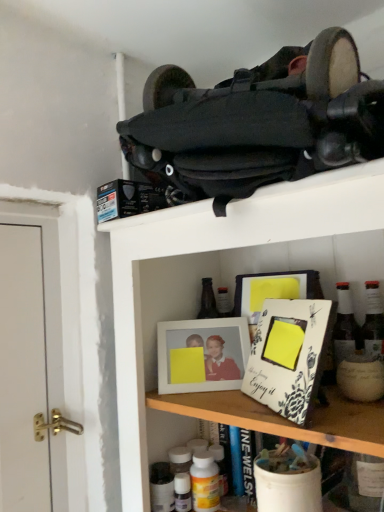
Question: Is yellow matte bottle at lower center smaller than white matte picture frame at center?

Choices:
 (A) yes
 (B) no

Answer: (A)

Question: Is yellow matte bottle at lower center turned away from white matte picture frame at center?

Choices:
 (A) no
 (B) yes

Answer: (A)

Question: Would you say white matte picture frame at center is part of yellow matte bottle at lower center's contents?

Choices:
 (A) yes
 (B) no

Answer: (B)

Question: From a real-world perspective, is yellow matte bottle at lower center under white matte picture frame at center?

Choices:
 (A) yes
 (B) no

Answer: (A)

Question: Does yellow matte bottle at lower center have a greater width compared to white matte picture frame at center?

Choices:
 (A) no
 (B) yes

Answer: (B)

Question: Would you say yellow matte bottle at lower center is a long distance from white matte picture frame at center?

Choices:
 (A) yes
 (B) no

Answer: (B)

Question: Is white matte picture frame at center to the right of yellow matte bottle at lower center from the viewer's perspective?

Choices:
 (A) no
 (B) yes

Answer: (A)

Question: From a real-world perspective, is white matte picture frame at center positioned under yellow matte bottle at lower center based on gravity?

Choices:
 (A) yes
 (B) no

Answer: (B)

Question: Is white matte picture frame at center at the left side of yellow matte bottle at lower center?

Choices:
 (A) yes
 (B) no

Answer: (A)

Question: Is yellow matte bottle at lower center surrounded by white matte picture frame at center?

Choices:
 (A) yes
 (B) no

Answer: (B)

Question: Is white matte picture frame at center outside of yellow matte bottle at lower center?

Choices:
 (A) no
 (B) yes

Answer: (B)

Question: Is the depth of white matte picture frame at center less than that of yellow matte bottle at lower center?

Choices:
 (A) yes
 (B) no

Answer: (B)

Question: Does point (x=185, y=344) appear closer or farther from the camera than point (x=203, y=503)?

Choices:
 (A) closer
 (B) farther

Answer: (B)